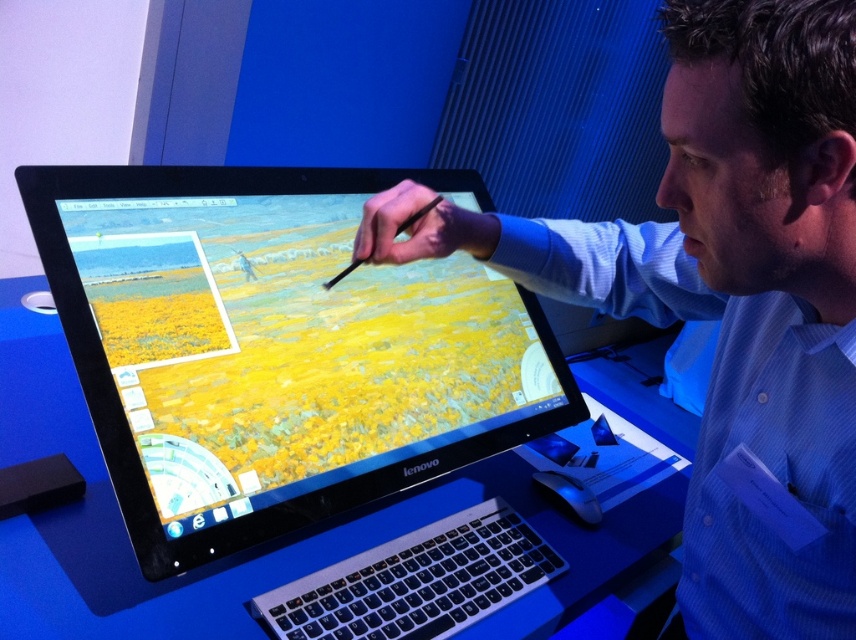
You are a graphic designer who needs to position a new lamp to illuminate the black glossy monitor at center. Based on the scene description, where should you place the lamp relative to the monitor to ensure optimal lighting?

The black glossy monitor at center is located at point [276,348], so the lamp should be positioned to avoid glare. Since the scene mentions cool blue lighting casting a soft glow, placing the lamp slightly above and to the side of the monitor would prevent reflections and ensure even illumination.

You are an artist trying to adjust your monitor height for better posture. The black glossy monitor at center and blue striped shirt at center are in your view. Which object is positioned higher from the floor?

The black glossy monitor at center is positioned higher than the blue striped shirt at center because it is above it.

You are a person who wants to place a 25 cm wide picture frame between the black glossy monitor at center and the blue striped shirt at center. Can you fit it there?

The black glossy monitor at center is 30.56 centimeters from the blue striped shirt at center. Since the distance between them is 30.56 cm, which is greater than the 25 cm width of the picture frame, you can fit the frame between them.